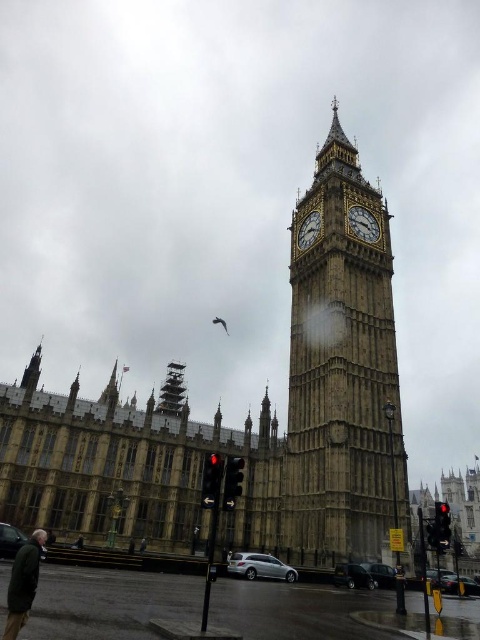
Find the location of a particular element. The height and width of the screenshot is (640, 480). dark green jacket at lower left is located at coordinates (23, 582).

Is point (14, 572) closer to viewer compared to point (440, 545)?

That is True.

Who is more forward, (14, 624) or (437, 524)?

Point (14, 624)

Locate an element on the screen. The width and height of the screenshot is (480, 640). dark green jacket at lower left is located at coordinates 23,582.

Between point (374, 252) and point (308, 221), which one is positioned in front?

Point (374, 252) is more forward.

Measure the distance between stone clock tower at center and gold textured clock at upper center.

stone clock tower at center and gold textured clock at upper center are 12.67 meters apart.

Does point (335, 301) lie in front of point (311, 241)?

Yes, it is in front of point (311, 241).

This screenshot has width=480, height=640. I want to click on stone clock tower at center, so click(342, 372).

Is dark green jacket at lower left shorter than gold textured clock at upper center?

Incorrect, dark green jacket at lower left's height does not fall short of gold textured clock at upper center's.

Which is behind, point (12, 600) or point (300, 241)?

The point (300, 241) is more distant.

What do you see at coordinates (23, 582) in the screenshot? The image size is (480, 640). I see `dark green jacket at lower left` at bounding box center [23, 582].

Locate an element on the screen. The image size is (480, 640). dark green jacket at lower left is located at coordinates (23, 582).